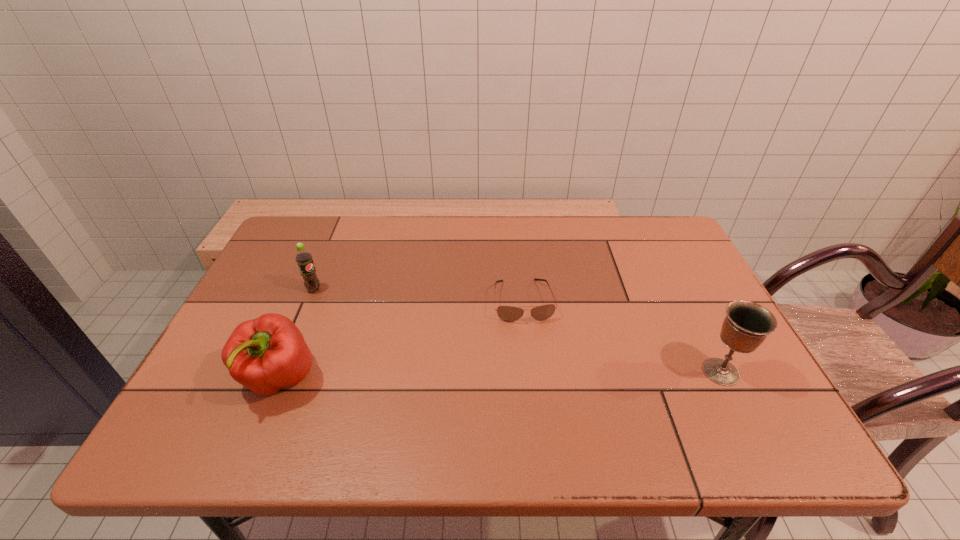
This screenshot has height=540, width=960. Identify the location of vacant space at the far edge. (480, 215).

What are the coordinates of `vacant space at the near edge of the desktop` in the screenshot? It's located at (578, 382).

Locate an element on the screen. This screenshot has width=960, height=540. vacant region at the left edge of the desktop is located at coordinates (293, 278).

The height and width of the screenshot is (540, 960). Find the location of `free space at the right edge of the desktop`. free space at the right edge of the desktop is located at coordinates (670, 302).

Locate an element on the screen. The image size is (960, 540). vacant space at the far right corner of the desktop is located at coordinates (635, 250).

Locate an element on the screen. free point between the rightmost object and the soda is located at coordinates (517, 330).

Locate an element on the screen. The height and width of the screenshot is (540, 960). vacant space that is in between the second object from right to left and the chalice is located at coordinates (622, 336).

Locate an element on the screen. free space between the shortest object and the soda is located at coordinates (419, 295).

Locate an element on the screen. The width and height of the screenshot is (960, 540). vacant space that is in between the rightmost object and the bell pepper is located at coordinates (500, 375).

This screenshot has width=960, height=540. I want to click on free space between the chalice and the sunglasses, so click(622, 336).